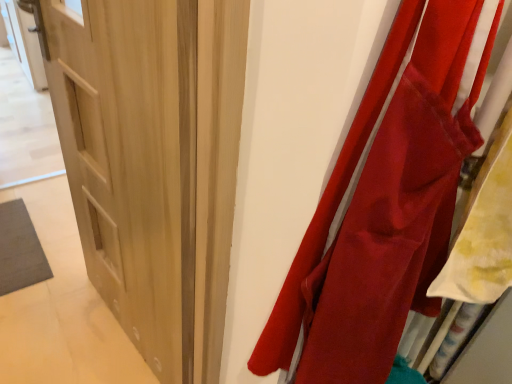
Question: Considering the relative sizes of light wood door at center and matte red fabric at right in the image provided, is light wood door at center taller than matte red fabric at right?

Choices:
 (A) no
 (B) yes

Answer: (B)

Question: From the image's perspective, is light wood door at center over matte red fabric at right?

Choices:
 (A) no
 (B) yes

Answer: (B)

Question: Considering the relative positions of light wood door at center and matte red fabric at right in the image provided, is light wood door at center in front of matte red fabric at right?

Choices:
 (A) no
 (B) yes

Answer: (A)

Question: Does light wood door at center have a lesser height compared to matte red fabric at right?

Choices:
 (A) yes
 (B) no

Answer: (B)

Question: Can you confirm if light wood door at center is positioned to the right of matte red fabric at right?

Choices:
 (A) no
 (B) yes

Answer: (A)

Question: Is light wood door at center thinner than matte red fabric at right?

Choices:
 (A) yes
 (B) no

Answer: (A)

Question: From a real-world perspective, is matte red fabric at right positioned under light wood door at center based on gravity?

Choices:
 (A) yes
 (B) no

Answer: (B)

Question: From the image's perspective, is matte red fabric at right beneath light wood door at center?

Choices:
 (A) no
 (B) yes

Answer: (B)

Question: Would you say matte red fabric at right contains light wood door at center?

Choices:
 (A) no
 (B) yes

Answer: (A)

Question: Considering the relative sizes of matte red fabric at right and light wood door at center in the image provided, is matte red fabric at right wider than light wood door at center?

Choices:
 (A) yes
 (B) no

Answer: (A)

Question: Is matte red fabric at right outside light wood door at center?

Choices:
 (A) no
 (B) yes

Answer: (B)

Question: Considering the relative sizes of matte red fabric at right and light wood door at center in the image provided, is matte red fabric at right bigger than light wood door at center?

Choices:
 (A) no
 (B) yes

Answer: (A)

Question: Which is correct: matte red fabric at right is inside light wood door at center, or outside of it?

Choices:
 (A) outside
 (B) inside

Answer: (A)